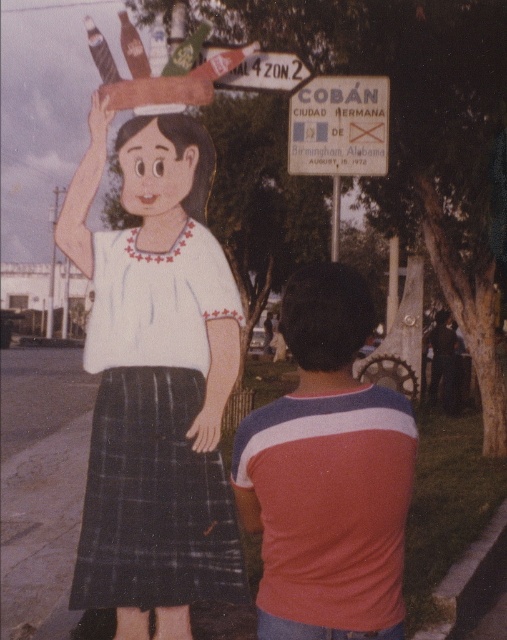
You are an artist trying to sketch the scene. You want to ensure the proportions are accurate. Which object, the matte white blouse at center or the dark brown hair at center, should you draw first to establish the correct scale since it is wider?

The matte white blouse at center should be drawn first because its width is larger than the dark brown hair at center, making it the wider object in the scene.

You are a traveler standing in front of the metallic silver sign at upper center and the striped cotton shirt at center. Which object is closer to your right side?

The striped cotton shirt at center is to the left of the metallic silver sign at upper center, so the metallic silver sign at upper center is closer to your right side.